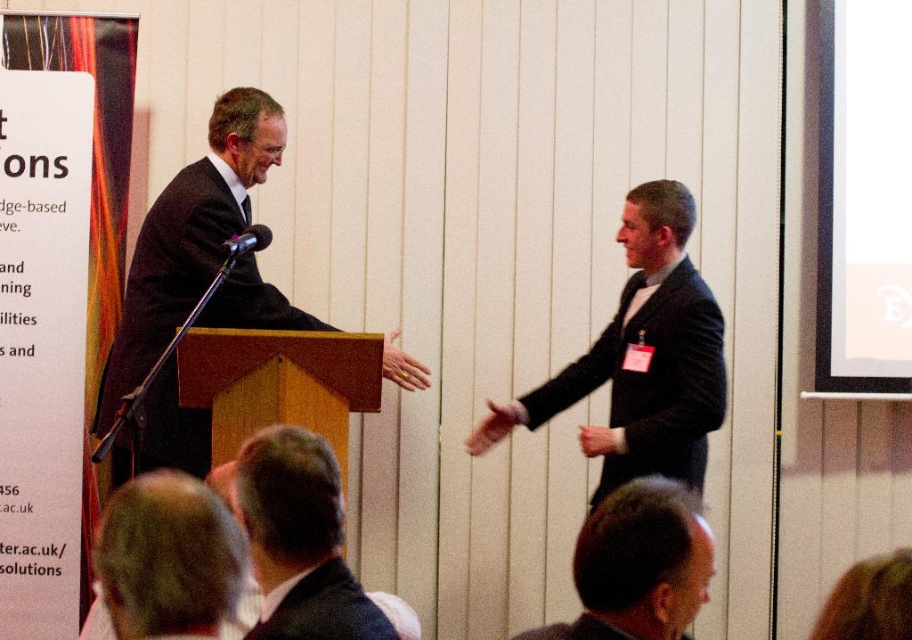
Is point (239, 180) closer to viewer compared to point (261, 625)?

That is False.

What are the coordinates of `dark suit at left` in the screenshot? It's located at (189, 237).

Does point (599, 524) lie behind point (250, 248)?

No.

Who is higher up, gray hair at lower center or black matte microphone at center?

black matte microphone at center

Which is in front, point (664, 552) or point (252, 237)?

Point (664, 552) is more forward.

Identify the location of gray hair at lower center. The image size is (912, 640). (638, 564).

Is black matte suit at right to the right of dark brown hair at lower center from the viewer's perspective?

Correct, you'll find black matte suit at right to the right of dark brown hair at lower center.

What do you see at coordinates (641, 356) in the screenshot? I see `black matte suit at right` at bounding box center [641, 356].

Locate an element on the screen. The image size is (912, 640). black matte suit at right is located at coordinates (641, 356).